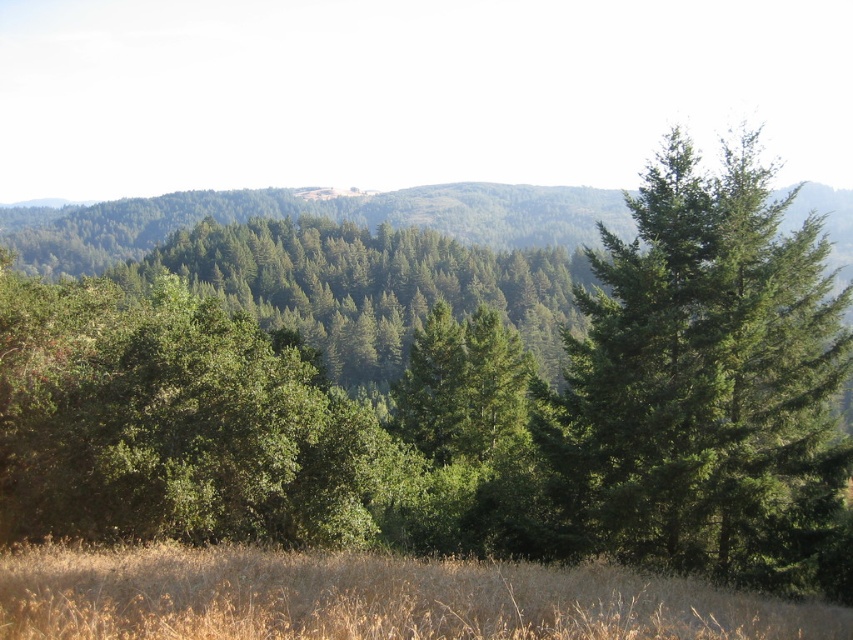
You are standing in the forest and want to move from point A to point B. Point A is at coordinates point [631,289] and point B is at coordinates point [828,632]. Which point is closer to you when you are facing the scene?

Point [631,289] is closer to you because it is further to the camera than point [828,632], meaning it is physically nearer in the scene.